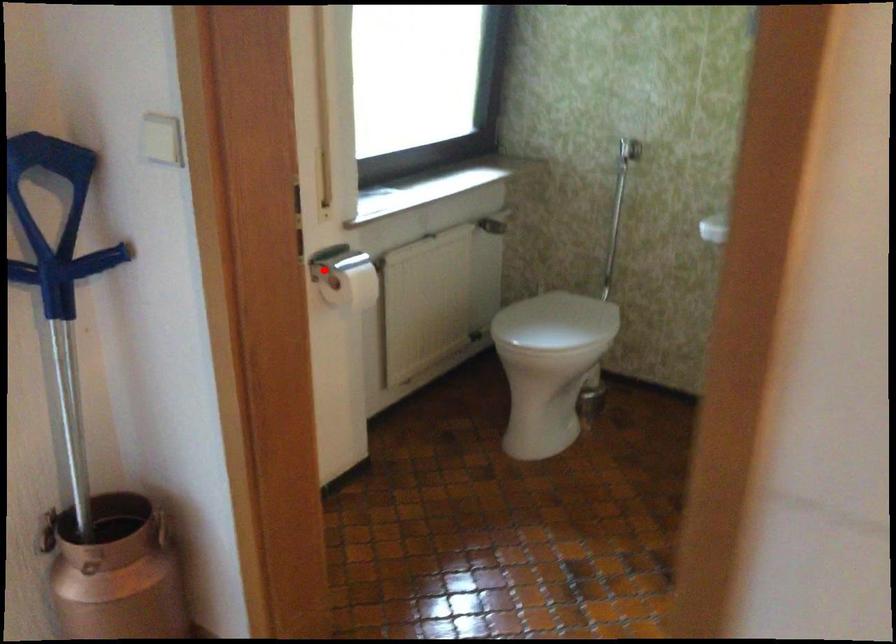
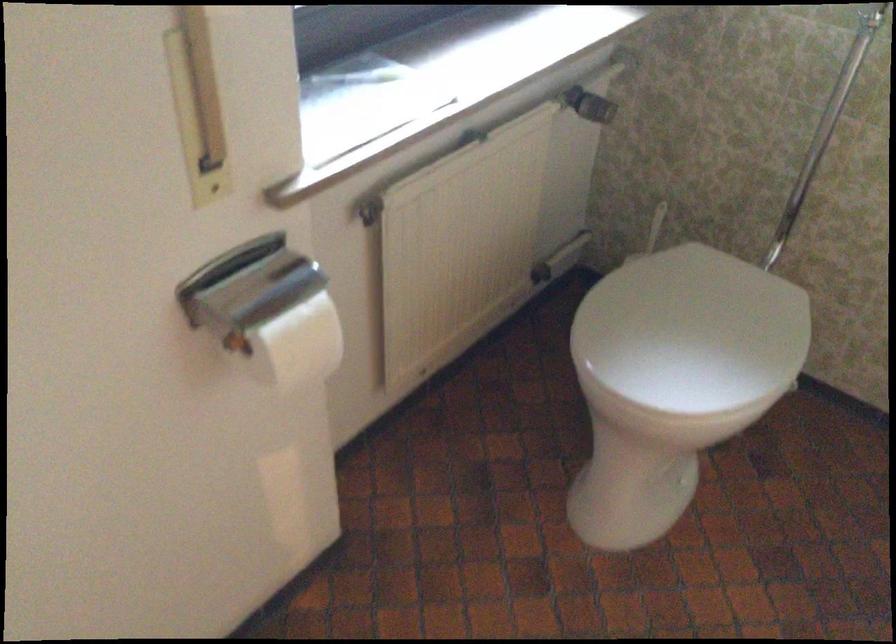
In the second image, find the point that corresponds to the highlighted location in the first image.

(247, 285)